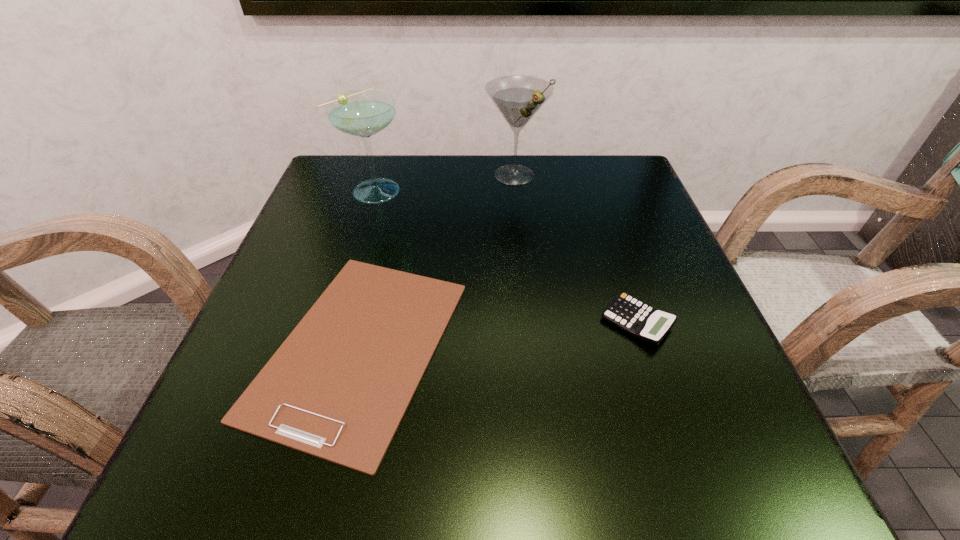
Identify which object is the second closest to the right martini. Please provide its 2D coordinates. Your answer should be formatted as a tuple, i.e. [(x, y)], where the tuple contains the x and y coordinates of a point satisfying the conditions above.

[(338, 387)]

I want to click on vacant region that satisfies the following two spatial constraints: 1. on the front side of the second shortest object; 2. on the right side of the right martini, so click(530, 322).

Where is `free space that satisfies the following two spatial constraints: 1. on the front side of the left martini; 2. on the right side of the clipboard`? free space that satisfies the following two spatial constraints: 1. on the front side of the left martini; 2. on the right side of the clipboard is located at coordinates (326, 347).

The image size is (960, 540). Identify the location of vacant space that satisfies the following two spatial constraints: 1. on the front side of the third object from left to right; 2. on the left side of the rightmost object. point(530,322).

Identify the location of blank area in the image that satisfies the following two spatial constraints: 1. on the front side of the shortest object; 2. on the left side of the left martini. The height and width of the screenshot is (540, 960). (326, 347).